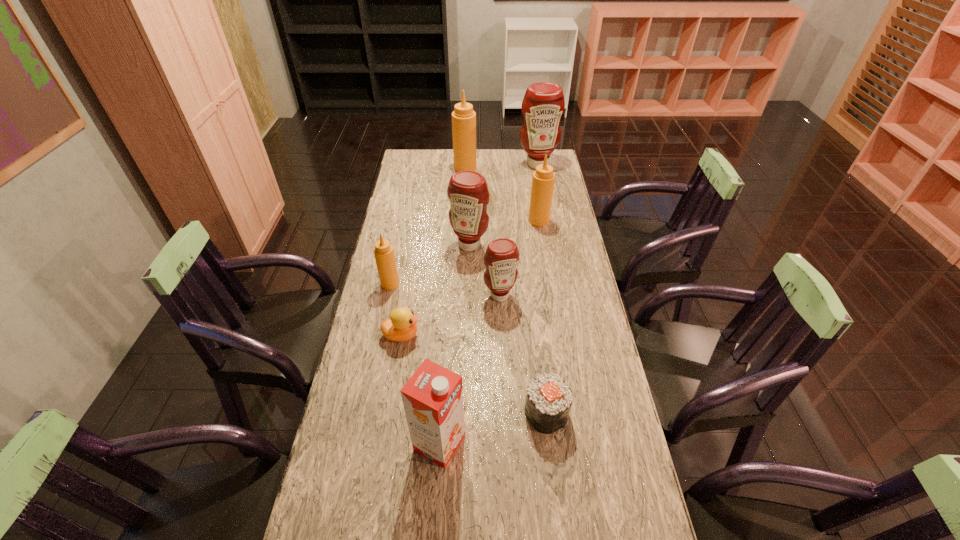
The image size is (960, 540). Identify the location of vacant space at the right edge. (598, 377).

Where is `vacant space that's between the second smallest tan condiment and the smallest tan condiment`? vacant space that's between the second smallest tan condiment and the smallest tan condiment is located at coordinates pos(465,252).

Find the location of `blank region between the sushi and the farthest red condiment`. blank region between the sushi and the farthest red condiment is located at coordinates (541, 289).

I want to click on free area in between the nearest red condiment and the farthest red condiment, so click(x=518, y=230).

At what (x,y) coordinates should I click in order to perform the action: click on empty space between the second farthest red condiment and the biggest red condiment. Please return your answer as a coordinate pair (x, y). The width and height of the screenshot is (960, 540). Looking at the image, I should click on (503, 205).

Image resolution: width=960 pixels, height=540 pixels. In order to click on vacant area that lies between the farthest red condiment and the carton in this screenshot , I will do `click(489, 303)`.

Locate an element on the screen. vacant area that lies between the carton and the sushi is located at coordinates (492, 428).

The height and width of the screenshot is (540, 960). Find the location of `vacant space that's between the carton and the third farthest condiment`. vacant space that's between the carton and the third farthest condiment is located at coordinates (489, 332).

I want to click on free point between the smallest red condiment and the sushi, so click(523, 354).

Identify the location of vacant space that is in between the biggest tan condiment and the seventh farthest object. (433, 252).